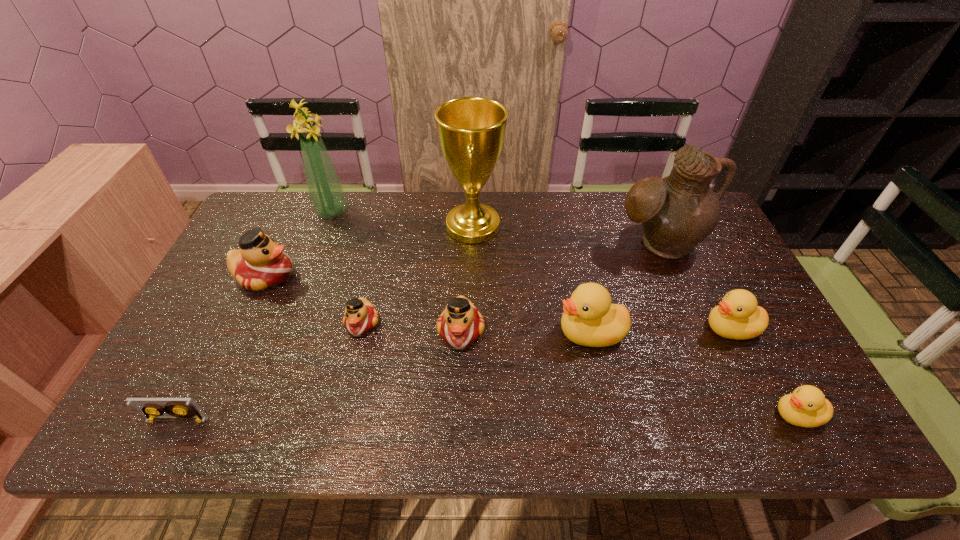
Where is `vacant space located on the face of the leftmost duck`? vacant space located on the face of the leftmost duck is located at coordinates (369, 275).

The width and height of the screenshot is (960, 540). In order to click on vacant region located 0.120m at the beak of the third duck from right to left in this screenshot , I will do `click(509, 333)`.

This screenshot has height=540, width=960. In order to click on vacant area situated at the beak of the third duck from right to left in this screenshot , I will do click(401, 333).

The image size is (960, 540). I want to click on blank space located at the beak of the third duck from right to left, so click(x=436, y=333).

What are the coordinates of `vacant space located on the face of the rightmost red duck` in the screenshot? It's located at (459, 395).

The width and height of the screenshot is (960, 540). I want to click on vacant space situated 0.060m at the beak of the second smallest yellow duck, so click(680, 328).

At what (x,y) coordinates should I click in order to perform the action: click on free space located 0.130m at the beak of the second smallest yellow duck. Please return your answer as a coordinate pair (x, y). Looking at the image, I should click on (653, 328).

At what (x,y) coordinates should I click in order to perform the action: click on vacant space located at the beak of the second smallest yellow duck. Please return your answer as a coordinate pair (x, y). This screenshot has height=540, width=960. Looking at the image, I should click on (637, 328).

The height and width of the screenshot is (540, 960). I want to click on free space located on the face of the smallest red duck, so [x=343, y=405].

This screenshot has width=960, height=540. In order to click on free space located at the beak of the nearest yellow duck in this screenshot , I will do `click(674, 415)`.